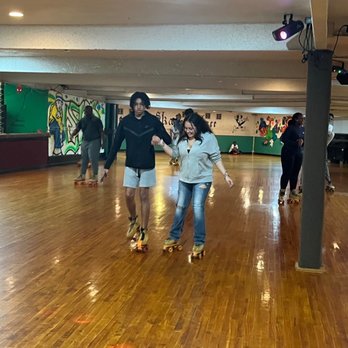
At what (x,y) coordinates should I click in order to perform the action: click on floor. Please return your answer as a coordinate pair (x, y). Looking at the image, I should click on (234, 312).